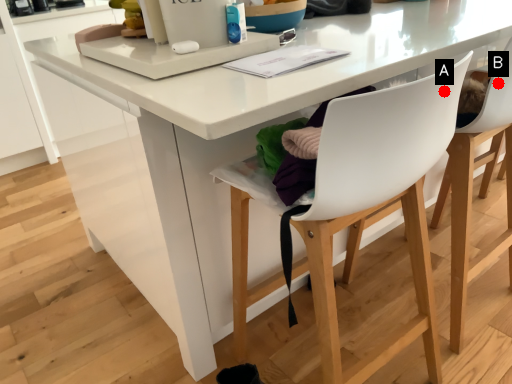
Question: Two points are circled on the image, labeled by A and B beside each circle. Among these points, which one is farthest from the camera?

Choices:
 (A) A is further
 (B) B is further

Answer: (B)